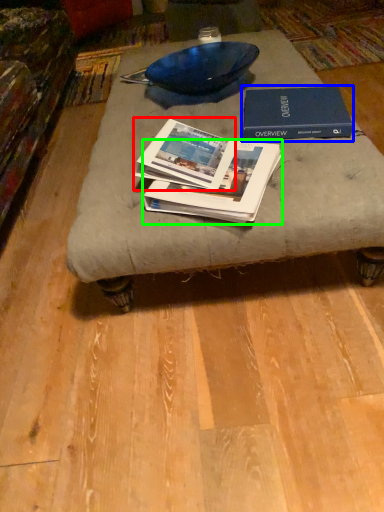
Question: Which object is positioned closest to book (highlighted by a red box)? Select from book (highlighted by a blue box) and book (highlighted by a green box).

Choices:
 (A) book
 (B) book

Answer: (B)